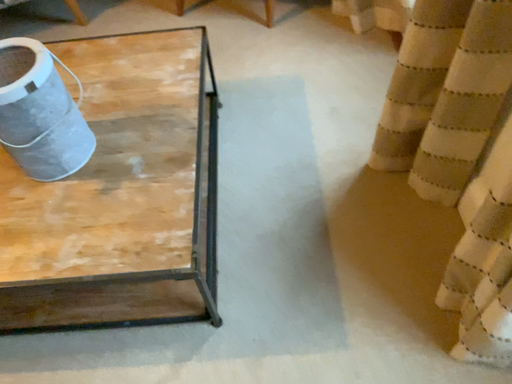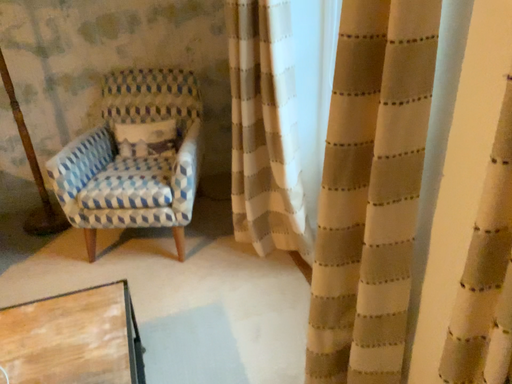
Question: How did the camera likely rotate when shooting the video?

Choices:
 (A) rotated upward
 (B) rotated downward

Answer: (A)